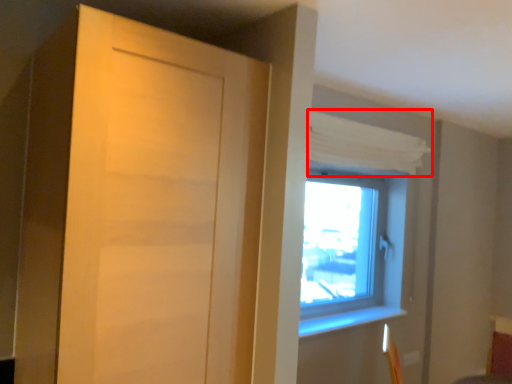
Question: Observing the image, what is the correct spatial positioning of curtain (annotated by the red box) in reference to door?

Choices:
 (A) left
 (B) right

Answer: (B)